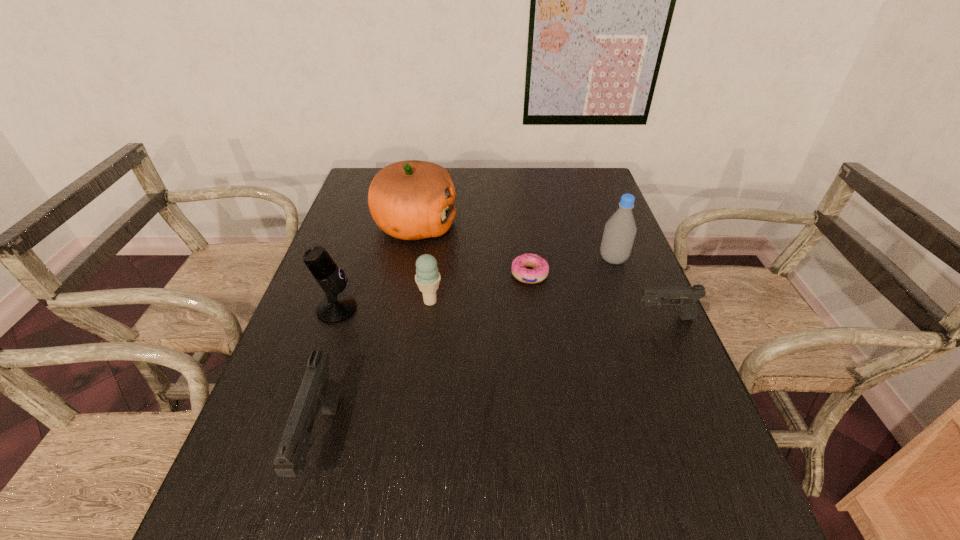
Please point a space for a new pistol to maintain equal intervals. Please provide its 2D coordinates. Your answer should be formatted as a tuple, i.e. [(x, y)], where the tuple contains the x and y coordinates of a point satisfying the conditions above.

[(515, 372)]